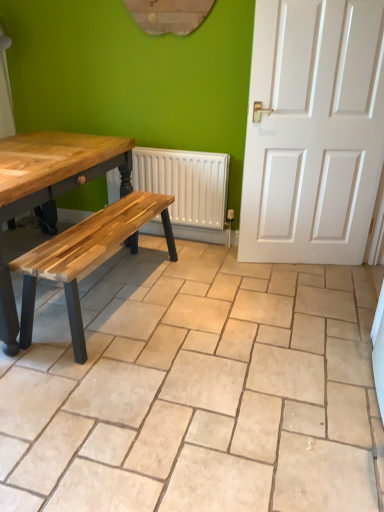
The width and height of the screenshot is (384, 512). In order to click on white textured radiator at center in this screenshot , I will do `click(185, 183)`.

Describe the element at coordinates (185, 183) in the screenshot. The width and height of the screenshot is (384, 512). I see `white textured radiator at center` at that location.

The width and height of the screenshot is (384, 512). What do you see at coordinates (196, 390) in the screenshot?
I see `beige ceramic tile at center` at bounding box center [196, 390].

Locate an element on the screen. The height and width of the screenshot is (512, 384). beige ceramic tile at center is located at coordinates (196, 390).

In order to face beige ceramic tile at center, should I rotate leftwards or rightwards?

A 8.912 degree turn to the left will do.

The image size is (384, 512). I want to click on white textured radiator at center, so click(185, 183).

In the image, is beige ceramic tile at center on the left side or the right side of white textured radiator at center?

Based on their positions, beige ceramic tile at center is located to the left of white textured radiator at center.

Does beige ceramic tile at center come behind white textured radiator at center?

No, the depth of beige ceramic tile at center is less than that of white textured radiator at center.

Is point (227, 256) closer or farther from the camera than point (213, 169)?

Point (227, 256).

From the image's perspective, is beige ceramic tile at center located above white textured radiator at center?

No.

From a real-world perspective, is beige ceramic tile at center physically below white textured radiator at center?

Yes.

Considering the sizes of beige ceramic tile at center and white textured radiator at center in the image, is beige ceramic tile at center wider or thinner than white textured radiator at center?

In the image, beige ceramic tile at center appears to be wider than white textured radiator at center.

Considering the sizes of beige ceramic tile at center and white textured radiator at center in the image, is beige ceramic tile at center taller or shorter than white textured radiator at center?

Considering their sizes, beige ceramic tile at center has less height than white textured radiator at center.

Does beige ceramic tile at center have a smaller size compared to white textured radiator at center?

Actually, beige ceramic tile at center might be larger than white textured radiator at center.

Would you say beige ceramic tile at center contains white textured radiator at center?

No.

Is beige ceramic tile at center with white textured radiator at center?

No.

Is white textured radiator at center at the back of beige ceramic tile at center?

No.

You are a GUI agent. You are given a task and a screenshot of the screen. Output one action in this format:
    pyautogui.click(x=<x>, y=<y>)
    Task: Click on the radiator located above the beige ceramic tile at center (from a real-world perspective)
    The image size is (384, 512).
    Given the screenshot: What is the action you would take?
    pyautogui.click(x=185, y=183)

Is white textured radiator at center at the left side of beige ceramic tile at center?

→ In fact, white textured radiator at center is to the right of beige ceramic tile at center.

Looking at this image, is white textured radiator at center behind beige ceramic tile at center?

Yes, the depth of white textured radiator at center is greater than that of beige ceramic tile at center.

Does point (167, 167) lie in front of point (246, 496)?

No.

From the image's perspective, who appears lower, white textured radiator at center or beige ceramic tile at center?

beige ceramic tile at center appears lower in the image.

From a real-world perspective, is white textured radiator at center physically located above or below beige ceramic tile at center?

white textured radiator at center is situated higher than beige ceramic tile at center in the real world.

Is white textured radiator at center thinner than beige ceramic tile at center?

Correct, the width of white textured radiator at center is less than that of beige ceramic tile at center.

From the picture: Between white textured radiator at center and beige ceramic tile at center, which one has more height?

white textured radiator at center.

Considering the sizes of objects white textured radiator at center and beige ceramic tile at center in the image provided, who is bigger, white textured radiator at center or beige ceramic tile at center?

Bigger between the two is beige ceramic tile at center.

Can we say white textured radiator at center lies outside beige ceramic tile at center?

That's correct, white textured radiator at center is outside of beige ceramic tile at center.

Is white textured radiator at center next to beige ceramic tile at center?

No, white textured radiator at center is not making contact with beige ceramic tile at center.

Is beige ceramic tile at center at the back of white textured radiator at center?

No, beige ceramic tile at center is not at the back of white textured radiator at center.

How different are the orientations of white textured radiator at center and beige ceramic tile at center in degrees?

89.3 degrees.

How much distance is there between white textured radiator at center and beige ceramic tile at center?

A distance of 1.05 meters exists between white textured radiator at center and beige ceramic tile at center.

This screenshot has width=384, height=512. I want to click on ceramic tile on the left of white textured radiator at center, so click(x=196, y=390).

I want to click on radiator above the beige ceramic tile at center (from the image's perspective), so click(185, 183).

You are a GUI agent. You are given a task and a screenshot of the screen. Output one action in this format:
    pyautogui.click(x=<x>, y=<y>)
    Task: Click on the ceramic tile that is under the white textured radiator at center (from a real-world perspective)
    This screenshot has width=384, height=512.
    Given the screenshot: What is the action you would take?
    pyautogui.click(x=196, y=390)